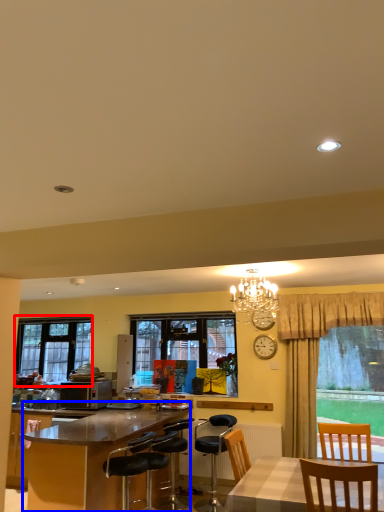
Question: Which point is further to the camera, window (highlighted by a red box) or desk (highlighted by a blue box)?

Choices:
 (A) window
 (B) desk

Answer: (A)